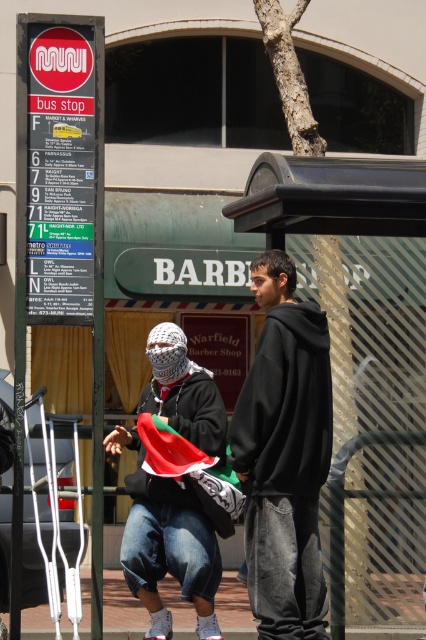
Which is more to the left, black cotton hoodie at center or white knitted headscarf at center?

Positioned to the left is white knitted headscarf at center.

From the picture: Who is more forward, (261, 525) or (169, 355)?

Positioned in front is point (261, 525).

Who is more forward, (x=293, y=468) or (x=176, y=324)?

Point (x=293, y=468)

The image size is (426, 640). In order to click on black cotton hoodie at center in this screenshot , I will do `click(284, 456)`.

Between point (333, 525) and point (275, 509), which one is positioned in front?

Positioned in front is point (275, 509).

This screenshot has height=640, width=426. Describe the element at coordinates (360, 360) in the screenshot. I see `black plastic bus stop at center` at that location.

The width and height of the screenshot is (426, 640). I want to click on black plastic bus stop at center, so click(x=360, y=360).

Between point (282, 353) and point (178, 593), which one is positioned in front?

Point (282, 353)

Does black cotton hoodie at center appear over brick pavement at lower center?

Correct, black cotton hoodie at center is located above brick pavement at lower center.

Does point (302, 477) lie in front of point (226, 580)?

Yes, it is.

Locate an element on the screen. The image size is (426, 640). black cotton hoodie at center is located at coordinates (284, 456).